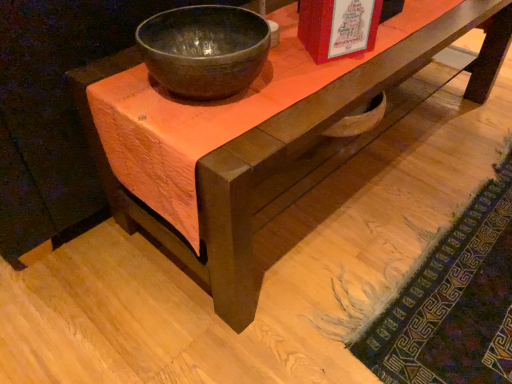
Question: Is matte dark gray bowl at center bigger than textured wool mat at lower right?

Choices:
 (A) no
 (B) yes

Answer: (A)

Question: From the image's perspective, is matte dark gray bowl at center over textured wool mat at lower right?

Choices:
 (A) no
 (B) yes

Answer: (B)

Question: From a real-world perspective, is matte dark gray bowl at center physically below textured wool mat at lower right?

Choices:
 (A) yes
 (B) no

Answer: (B)

Question: From a real-world perspective, is matte dark gray bowl at center located higher than textured wool mat at lower right?

Choices:
 (A) no
 (B) yes

Answer: (B)

Question: From the image's perspective, is matte dark gray bowl at center under textured wool mat at lower right?

Choices:
 (A) yes
 (B) no

Answer: (B)

Question: Is matte dark gray bowl at center thinner than textured wool mat at lower right?

Choices:
 (A) no
 (B) yes

Answer: (B)

Question: From a real-world perspective, is matte dark gray bowl at center below matte red book at upper center?

Choices:
 (A) yes
 (B) no

Answer: (A)

Question: From a real-world perspective, is matte dark gray bowl at center located higher than matte red book at upper center?

Choices:
 (A) no
 (B) yes

Answer: (A)

Question: Considering the relative sizes of matte dark gray bowl at center and matte red book at upper center in the image provided, is matte dark gray bowl at center taller than matte red book at upper center?

Choices:
 (A) yes
 (B) no

Answer: (B)

Question: Does matte dark gray bowl at center contain matte red book at upper center?

Choices:
 (A) no
 (B) yes

Answer: (A)

Question: From the image's perspective, does matte dark gray bowl at center appear lower than matte red book at upper center?

Choices:
 (A) yes
 (B) no

Answer: (A)

Question: Is matte dark gray bowl at center located outside matte red book at upper center?

Choices:
 (A) yes
 (B) no

Answer: (A)

Question: Is textured wool mat at lower right with matte red book at upper center?

Choices:
 (A) yes
 (B) no

Answer: (B)